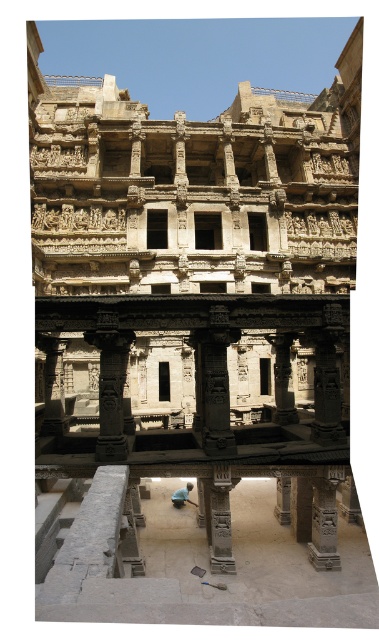
You are an architect visiting this historical site and want to take a photo of both the carved stone pillar at center and the light blue fabric at center. Since you want the pillar to dominate the photo, which object should you position closer to the camera?

The carved stone pillar at center is much taller than the light blue fabric at center. To make the pillar dominate the photo, you should position the light blue fabric at center closer to the camera since it is smaller and needs to be magnified to balance the composition.

You are standing at the entrance of the historical stepwell and want to take a photo of the point at coordinates (128, 410). If your camera has a maximum focus range of 60 meters, will it be able to focus on that point?

The distance of point (128, 410) from the viewer is 62.18 meters, which exceeds the camera maximum focus range of 60 meters. Therefore, the camera will not be able to focus on that point.

You are an architect designing a restoration plan for the historical monument. You need to determine the spatial relationship between the carved stone pillar at center and the light blue fabric at center. Which object occupies more horizontal space in the scene?

The carved stone pillar at center might be wider than light blue fabric at center, so it likely occupies more horizontal space.